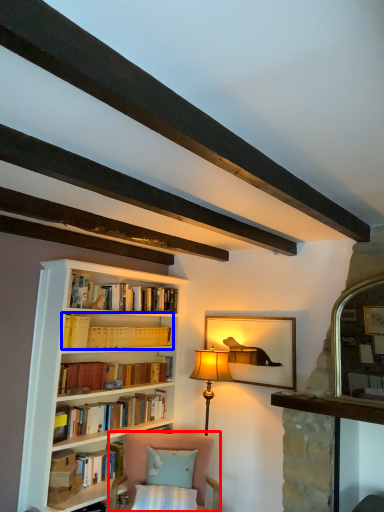
Question: Which point is further to the camera, chair (highlighted by a red box) or book (highlighted by a blue box)?

Choices:
 (A) chair
 (B) book

Answer: (B)